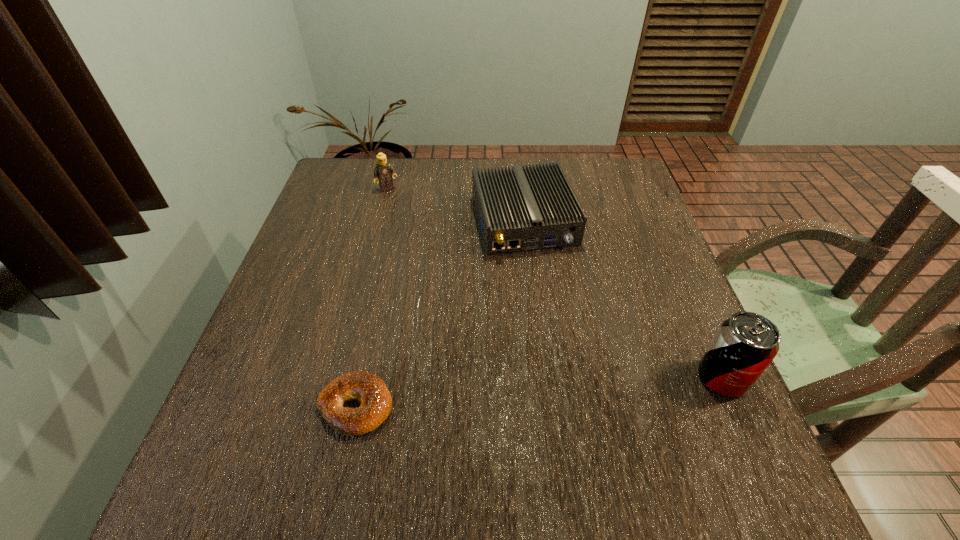
Identify the location of free space located on the back panel of the router. This screenshot has height=540, width=960. (573, 363).

Identify the location of free space located in front of the Lego. (439, 263).

Image resolution: width=960 pixels, height=540 pixels. I want to click on free space located 0.130m in front of the Lego, so click(x=408, y=218).

Image resolution: width=960 pixels, height=540 pixels. What are the coordinates of `vacant region located in front of the Lego` in the screenshot? It's located at (435, 258).

Where is `router that is at the far edge`? This screenshot has width=960, height=540. router that is at the far edge is located at coordinates (535, 208).

Identify the location of Lego present at the far edge. This screenshot has width=960, height=540. (384, 172).

Locate an element on the screen. This screenshot has height=540, width=960. bagel that is at the near edge is located at coordinates (367, 388).

I want to click on soda can that is at the near edge, so click(x=746, y=343).

What are the coordinates of `object at the left edge` in the screenshot? It's located at (384, 172).

Locate an element on the screen. object at the right edge is located at coordinates (746, 343).